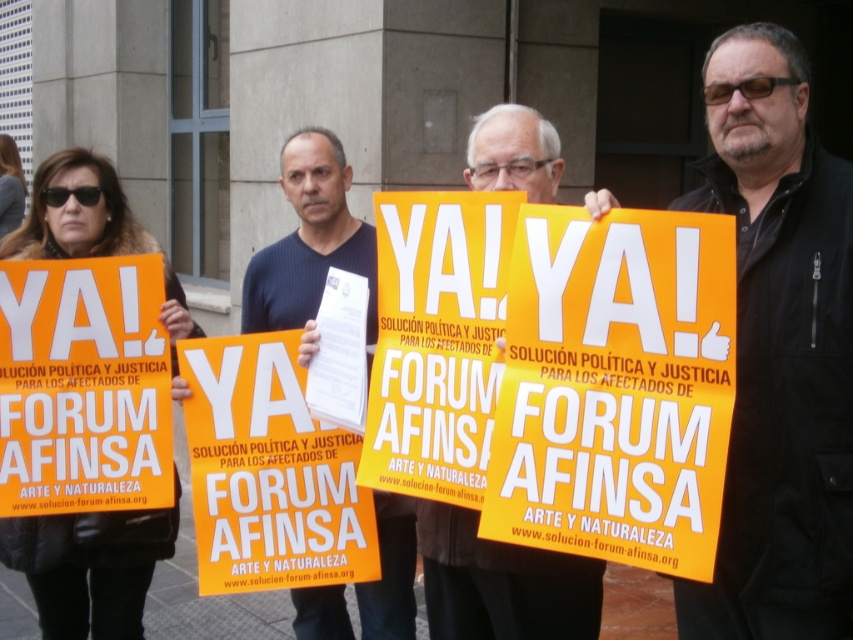
You are a photographer trying to capture a clear shot of the matte yellow sign at center and the dark blue shirt at center. Considering their heights, which object should you adjust your camera angle to look up at?

You should adjust your camera angle to look up at the dark blue shirt at center because the matte yellow sign at center has a lesser height compared to dark blue shirt at center.

You are a photographer trying to capture a clear shot of the dark blue shirt at center and the matte yellow sign at center. Based on their positions, which object should you focus on first to ensure both are in frame?

The dark blue shirt at center is to the left of the matte yellow sign at center, so focusing on the dark blue shirt at center first will allow you to include both in the frame as you adjust the camera angle to the right to capture the matte yellow sign at center.